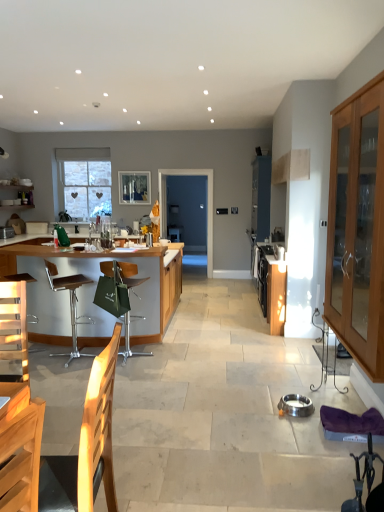
Question: Is clear glass window at upper left aimed at wooden cabinet at center, the 1th cabinetry when ordered from back to front?

Choices:
 (A) no
 (B) yes

Answer: (A)

Question: Does clear glass window at upper left come behind wooden cabinet at center, the 2th cabinetry when ordered from left to right?

Choices:
 (A) no
 (B) yes

Answer: (B)

Question: Can you confirm if clear glass window at upper left is smaller than wooden cabinet at center, the 1th cabinetry when ordered from back to front?

Choices:
 (A) yes
 (B) no

Answer: (B)

Question: Is clear glass window at upper left positioned in front of wooden cabinet at center, which ranks as the 2th cabinetry in right-to-left order?

Choices:
 (A) no
 (B) yes

Answer: (A)

Question: Is clear glass window at upper left outside of wooden cabinet at center, placed as the third cabinetry when sorted from front to back?

Choices:
 (A) no
 (B) yes

Answer: (B)

Question: Considering the relative sizes of clear glass window at upper left and wooden cabinet at center, the 2th cabinetry when ordered from left to right, in the image provided, is clear glass window at upper left bigger than wooden cabinet at center, the 2th cabinetry when ordered from left to right,?

Choices:
 (A) no
 (B) yes

Answer: (B)

Question: Is wooden armchair at lower left positioned far away from stainless steel oven at center-right, the 1th appliance from the right?

Choices:
 (A) no
 (B) yes

Answer: (B)

Question: Can you confirm if wooden armchair at lower left is positioned to the left of stainless steel oven at center-right, marked as the 2th appliance in a back-to-front arrangement?

Choices:
 (A) no
 (B) yes

Answer: (B)

Question: Could you tell me if wooden armchair at lower left is turned towards stainless steel oven at center-right, the second appliance viewed from the front?

Choices:
 (A) no
 (B) yes

Answer: (A)

Question: From a real-world perspective, is wooden armchair at lower left beneath stainless steel oven at center-right, the second appliance viewed from the front?

Choices:
 (A) yes
 (B) no

Answer: (A)

Question: Does wooden armchair at lower left have a smaller size compared to stainless steel oven at center-right, which is the second appliance from top to bottom?

Choices:
 (A) no
 (B) yes

Answer: (A)

Question: Considering the relative sizes of wooden armchair at lower left and stainless steel oven at center-right, which appears as the 3th appliance when viewed from the left, in the image provided, is wooden armchair at lower left thinner than stainless steel oven at center-right, which appears as the 3th appliance when viewed from the left,?

Choices:
 (A) yes
 (B) no

Answer: (B)

Question: Can transparent glass door at center be found inside clear glass window screen at upper center?

Choices:
 (A) no
 (B) yes

Answer: (A)